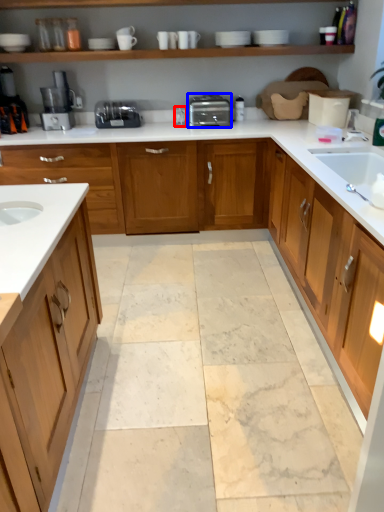
Question: Among these objects, which one is nearest to the camera, faucet (highlighted by a red box) or toaster (highlighted by a blue box)?

Choices:
 (A) faucet
 (B) toaster

Answer: (B)